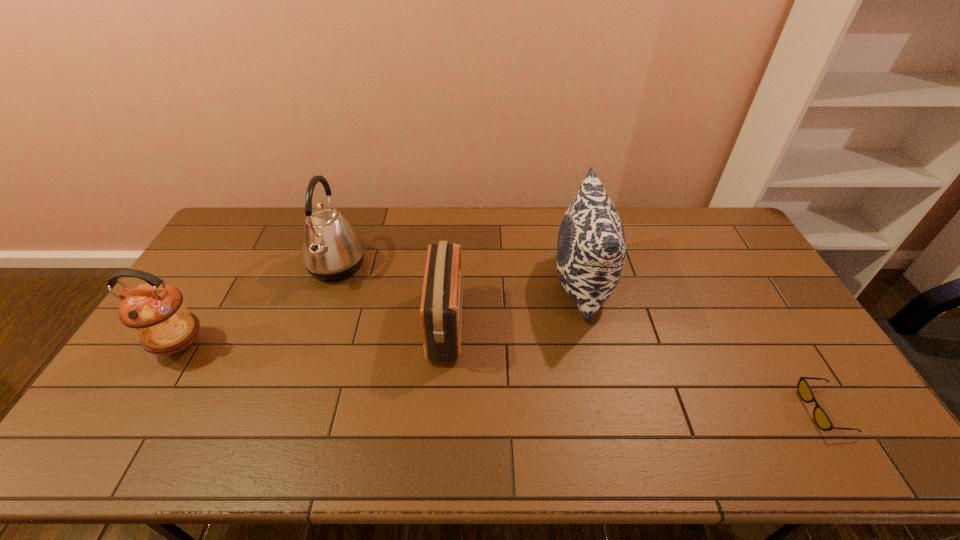
What are the coordinates of `vacant space situated 0.330m on the front surface of the second object from right to left` in the screenshot? It's located at (452, 284).

Where is `free point located 0.070m on the back of the leftmost object`? Image resolution: width=960 pixels, height=540 pixels. free point located 0.070m on the back of the leftmost object is located at coordinates (203, 308).

Identify the location of vacant region located 0.240m on the front-facing side of the third object from right to left. This screenshot has height=540, width=960. (542, 325).

Locate an element on the screen. vacant space situated on the front-facing side of the nearest object is located at coordinates (674, 410).

Identify the location of free space located 0.180m on the front-facing side of the nearest object. (737, 410).

Where is `free space located on the front-facing side of the nearest object`? The height and width of the screenshot is (540, 960). free space located on the front-facing side of the nearest object is located at coordinates (729, 410).

Locate an element on the screen. object located at the far edge is located at coordinates (331, 249).

At what (x,y) coordinates should I click in order to perform the action: click on object located at the near edge. Please return your answer as a coordinate pair (x, y). This screenshot has height=540, width=960. Looking at the image, I should click on (822, 420).

Find the location of `object at the left edge`. object at the left edge is located at coordinates (155, 310).

This screenshot has width=960, height=540. In order to click on object present at the right edge in this screenshot , I will do `click(822, 420)`.